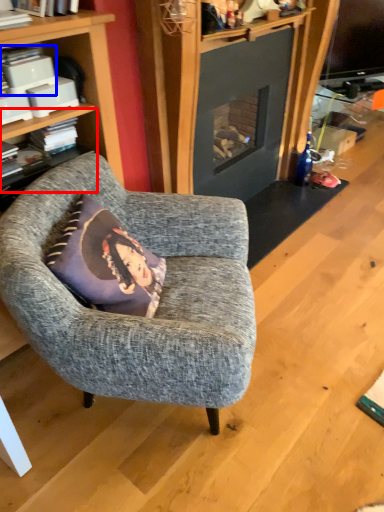
Question: Which object is further to the camera taking this photo, shelf (highlighted by a red box) or book (highlighted by a blue box)?

Choices:
 (A) shelf
 (B) book

Answer: (A)